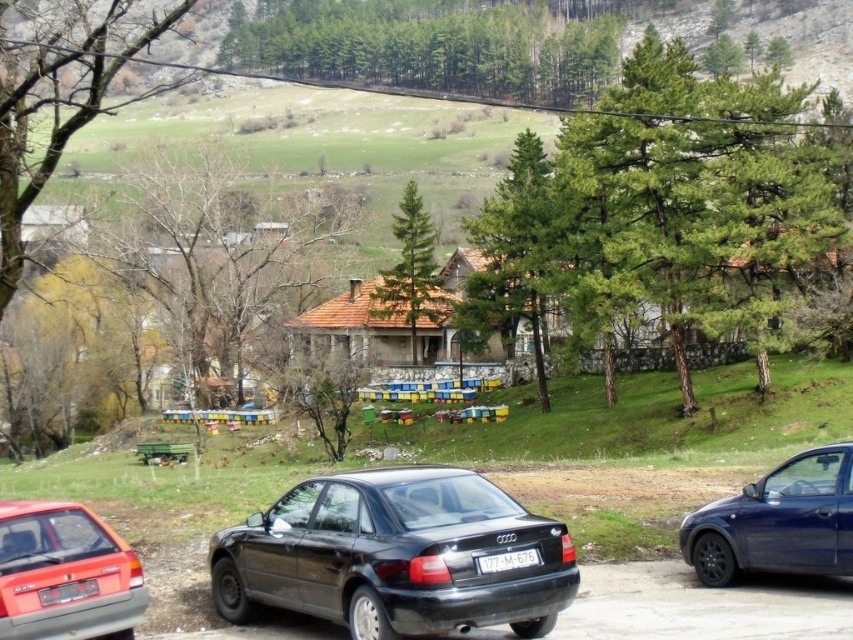
You are a photographer trying to capture the black glossy sedan at center and the white plastic license plate at center in a single shot. Since the sedan is taller than the license plate, which object will appear larger in your photo?

The black glossy sedan at center will appear larger in the photo because it has a greater height compared to the white plastic license plate at center.

You are a pedestrian standing at the edge of the paved area where the black glossy sedan at center and the matte red sedan at lower left are parked. You want to walk to the grassy hill in the middle ground. Which car do you need to walk around to reach the hill?

You need to walk around the matte red sedan at lower left because the black glossy sedan at center is closer to you, blocking the path to the matte red sedan at lower left which is further away.